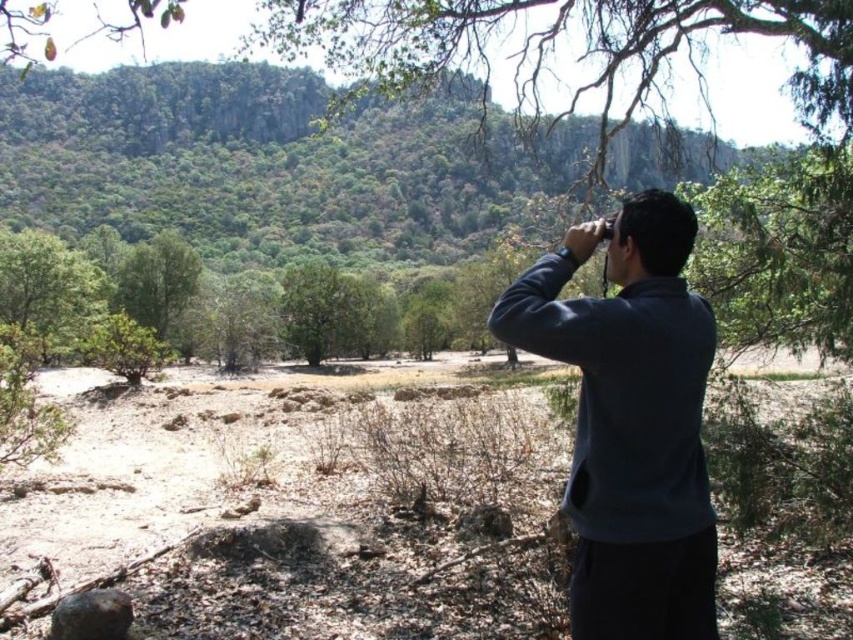
You are a hiker trying to determine which tree to climb for a better view. The green leafy tree at left and the green leafy tree at center are both in your sight. Which tree has a wider trunk? Please choose between them based on their widths.

The green leafy tree at left has a wider trunk than the green leafy tree at center because its width surpasses the latter.